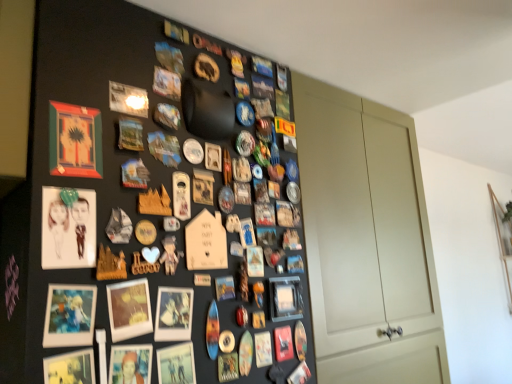
Question: Is matte paper picture frame at left, the 7th picture frame in the right-to-left sequence, closer to camera compared to matte black picture frame at lower left, positioned as the fifth picture frame in right-to-left order?

Choices:
 (A) yes
 (B) no

Answer: (B)

Question: From the image's perspective, is matte paper picture frame at left, which is counted as the 2th picture frame, starting from the left, beneath matte black picture frame at lower left, positioned as the fifth picture frame in right-to-left order?

Choices:
 (A) no
 (B) yes

Answer: (A)

Question: Is matte paper picture frame at left, the 7th picture frame in the right-to-left sequence, not near matte black picture frame at lower left, placed as the fourth picture frame when sorted from left to right?

Choices:
 (A) yes
 (B) no

Answer: (B)

Question: Is matte paper picture frame at left, the 7th picture frame in the right-to-left sequence, not inside matte black picture frame at lower left, positioned as the fifth picture frame in right-to-left order?

Choices:
 (A) no
 (B) yes

Answer: (B)

Question: Is matte paper picture frame at left, the 7th picture frame in the right-to-left sequence, at the right side of matte black picture frame at lower left, placed as the fourth picture frame when sorted from left to right?

Choices:
 (A) no
 (B) yes

Answer: (A)

Question: Can you confirm if matte paper picture frame at left, the 7th picture frame in the right-to-left sequence, is bigger than matte black picture frame at lower left, positioned as the fifth picture frame in right-to-left order?

Choices:
 (A) no
 (B) yes

Answer: (A)

Question: From a real-world perspective, is matte plastic picture frame at lower left, which appears as the third picture frame when viewed from the right, located higher than matte white door at center-right?

Choices:
 (A) yes
 (B) no

Answer: (B)

Question: Is matte plastic picture frame at lower left, acting as the sixth picture frame starting from the left, not close to matte white door at center-right?

Choices:
 (A) yes
 (B) no

Answer: (B)

Question: Is matte plastic picture frame at lower left, acting as the sixth picture frame starting from the left, facing away from matte white door at center-right?

Choices:
 (A) yes
 (B) no

Answer: (B)

Question: From the image's perspective, does matte plastic picture frame at lower left, acting as the sixth picture frame starting from the left, appear lower than matte white door at center-right?

Choices:
 (A) yes
 (B) no

Answer: (A)

Question: Is matte plastic picture frame at lower left, acting as the sixth picture frame starting from the left, further to the viewer compared to matte white door at center-right?

Choices:
 (A) no
 (B) yes

Answer: (A)

Question: Is matte plastic picture frame at lower left, which appears as the third picture frame when viewed from the right, at the right side of matte white door at center-right?

Choices:
 (A) no
 (B) yes

Answer: (A)

Question: From the image's perspective, is matte black picture frame at lower right, positioned as the 8th picture frame in left-to-right order, over matte wooden picture frame at upper left, arranged as the eighth picture frame when viewed from the right?

Choices:
 (A) no
 (B) yes

Answer: (A)